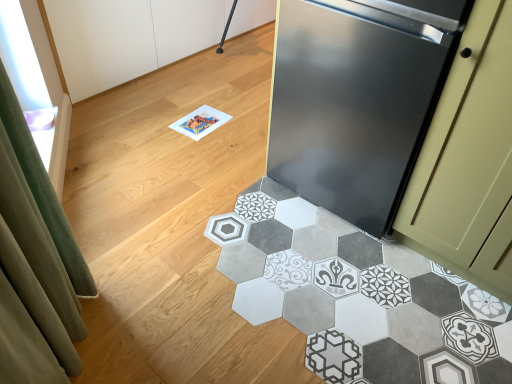
In order to click on free region under patterned tile floor at lower right (from a real-world perspective) in this screenshot , I will do `click(321, 311)`.